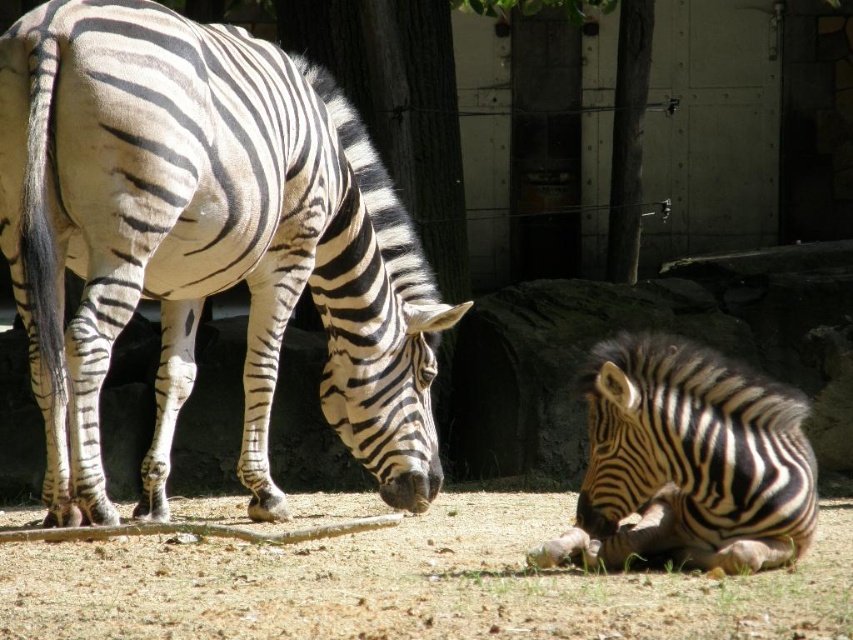
Question: Considering the relative positions of black and white striped zebra at left and black and white striped zebra at lower right in the image provided, where is black and white striped zebra at left located with respect to black and white striped zebra at lower right?

Choices:
 (A) below
 (B) above

Answer: (B)

Question: Does black and white striped zebra at left have a larger size compared to smooth bark tree at center?

Choices:
 (A) no
 (B) yes

Answer: (B)

Question: Which of the following is the farthest from the observer?

Choices:
 (A) smooth bark tree at center
 (B) green grass at lower center
 (C) black and white striped zebra at lower right

Answer: (A)

Question: Does black and white striped zebra at left appear on the right side of black and white striped zebra at lower right?

Choices:
 (A) yes
 (B) no

Answer: (B)

Question: Among these objects, which one is nearest to the camera?

Choices:
 (A) black and white striped zebra at lower right
 (B) black and white striped zebra at left
 (C) green grass at lower center
 (D) smooth bark tree at center

Answer: (C)

Question: Considering the real-world distances, which object is closest to the green grass at lower center?

Choices:
 (A) black and white striped zebra at left
 (B) smooth bark tree at center
 (C) black and white striped zebra at lower right

Answer: (C)